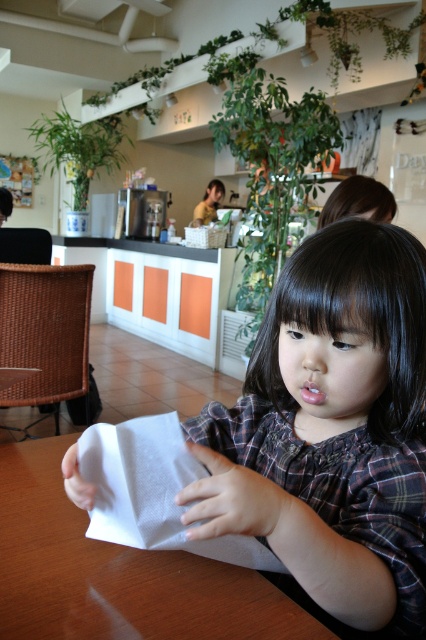
Question: Observing the image, what is the correct spatial positioning of white paper napkin at center in reference to white paper at center?

Choices:
 (A) right
 (B) left

Answer: (A)

Question: Is white paper napkin at center thinner than white paper at center?

Choices:
 (A) yes
 (B) no

Answer: (A)

Question: In this image, where is white paper napkin at center located relative to white paper at center?

Choices:
 (A) right
 (B) left

Answer: (A)

Question: Among these points, which one is nearest to the camera?

Choices:
 (A) (103, 588)
 (B) (325, 454)

Answer: (A)